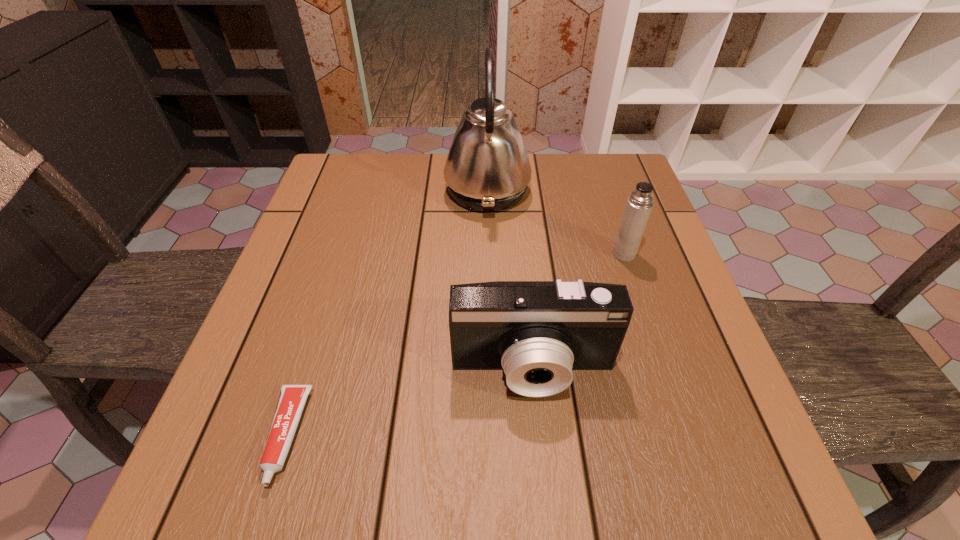
Locate an element on the screen. The height and width of the screenshot is (540, 960). vacant area between the tallest object and the second farthest object is located at coordinates (556, 222).

Locate which object is the third closest to the leftmost object. Please provide its 2D coordinates. Your answer should be formatted as a tuple, i.e. [(x, y)], where the tuple contains the x and y coordinates of a point satisfying the conditions above.

[(639, 204)]

At what (x,y) coordinates should I click in order to perform the action: click on object that can be found as the third closest to the leftmost object. Please return your answer as a coordinate pair (x, y). This screenshot has height=540, width=960. Looking at the image, I should click on (639, 204).

Locate an element on the screen. The image size is (960, 540). free location that satisfies the following two spatial constraints: 1. from the spout of the tallest object; 2. at the nozzle of the shortest object is located at coordinates (492, 436).

Locate an element on the screen. The image size is (960, 540). free space that satisfies the following two spatial constraints: 1. from the spout of the rightmost object; 2. on the left side of the kettle is located at coordinates (489, 254).

Identify the location of blank space that satisfies the following two spatial constraints: 1. from the spout of the tallest object; 2. at the nozzle of the shortest object. The image size is (960, 540). (492, 436).

Locate an element on the screen. This screenshot has height=540, width=960. free space that satisfies the following two spatial constraints: 1. from the spout of the farthest object; 2. on the right side of the thermos bottle is located at coordinates (489, 254).

The width and height of the screenshot is (960, 540). I want to click on vacant area in the image that satisfies the following two spatial constraints: 1. on the back side of the thermos bottle; 2. from the spout of the tallest object, so click(x=603, y=191).

Locate an element on the screen. vacant area in the image that satisfies the following two spatial constraints: 1. from the spout of the tallest object; 2. on the right side of the second farthest object is located at coordinates pyautogui.click(x=489, y=254).